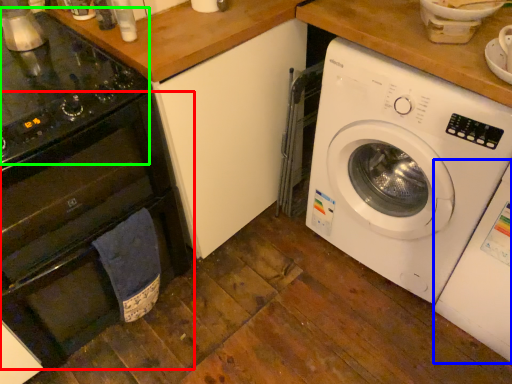
Question: Based on their relative distances, which object is nearer to oven (highlighted by a red box)? Choose from washing machine (highlighted by a blue box) and gas stove (highlighted by a green box).

Choices:
 (A) washing machine
 (B) gas stove

Answer: (B)